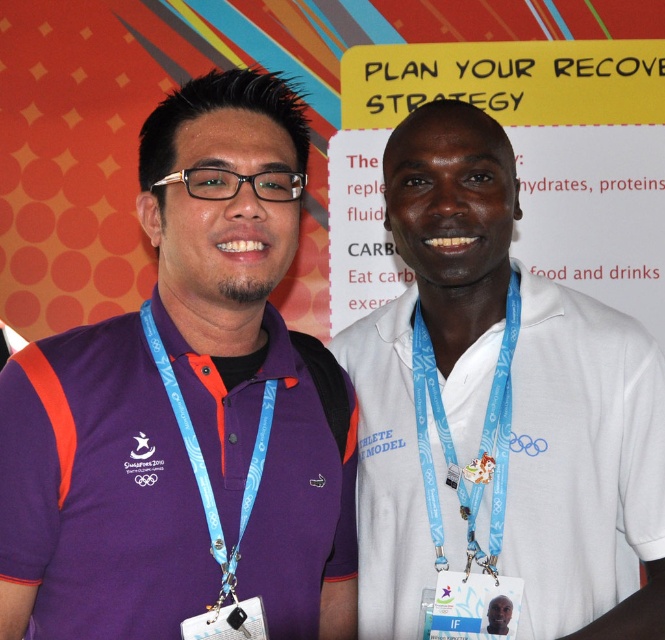
You are at a sports event and see two people in front of you. The first person is wearing a blue fabric lanyard at left and the second is wearing a purple fabric at center. From your perspective, which fabric is positioned to the right?

The blue fabric lanyard at left is positioned to the right of the purple fabric at center.

You are a photographer preparing to take a group photo of two people in front of a colorful background. You notice the purple fabric at center and the white fabric neck at center. Which fabric should you adjust to ensure both are visible in the frame?

The purple fabric at center is much taller than the white fabric neck at center, so you should lower the purple fabric at center to ensure both are visible in the frame.

You are at an event and notice two people in the image. The person on the left has a blue fabric lanyard at left and the person on the right has a purple fabric at center. Which item is positioned lower on their respective bodies?

The blue fabric lanyard at left is located below the purple fabric at center, so the blue lanyard is positioned lower on the person on the left compared to the purple fabric on the person on the right.